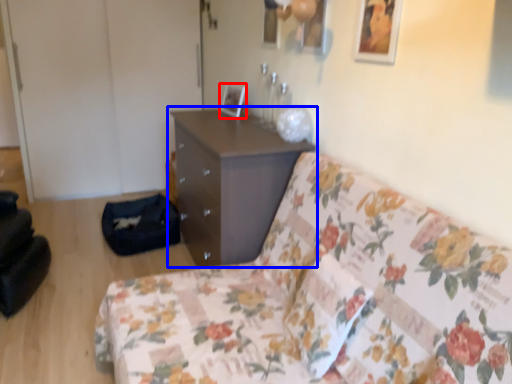
Question: Among these objects, which one is nearest to the camera, picture frame (highlighted by a red box) or chest of drawers (highlighted by a blue box)?

Choices:
 (A) picture frame
 (B) chest of drawers

Answer: (B)